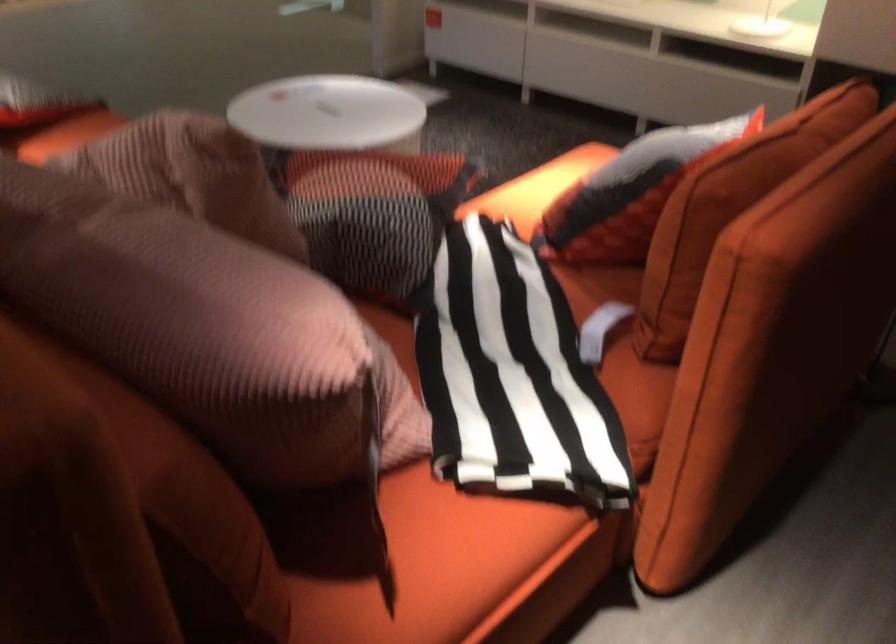
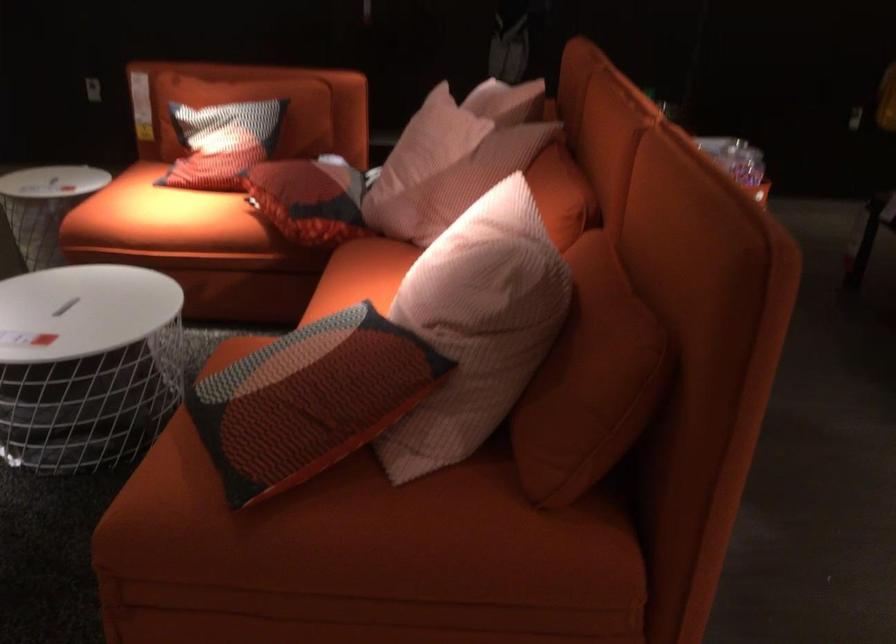
Question: I am providing you with two images of the same scene from different viewpoints. Which of the following objects are not visible in image2?

Choices:
 (A) orange sofa sitting surface
 (B) patterned pillow
 (C) pink rectangular pillow
 (D) sofa sitting surface

Answer: (D)